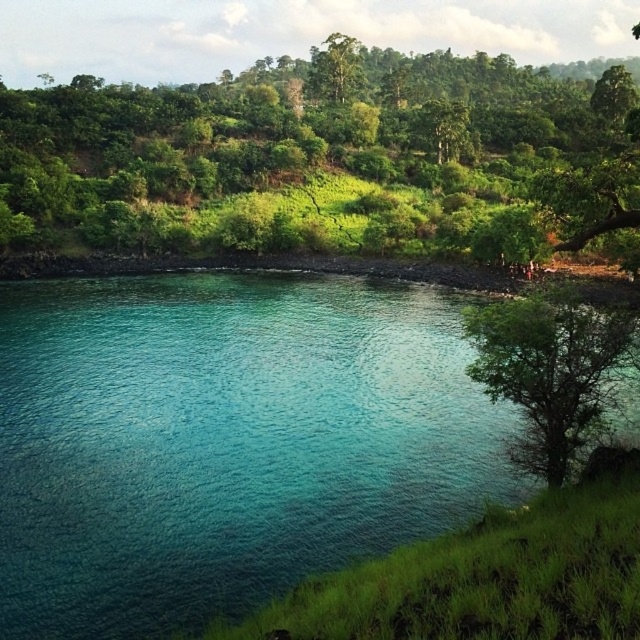
You are standing on the grassy slope and want to take a photo of the teal glossy water at center and the green leafy tree at center. Which object will appear closer to the camera in the photo?

The teal glossy water at center will appear closer to the camera in the photo because it is positioned in front of the green leafy tree at center.